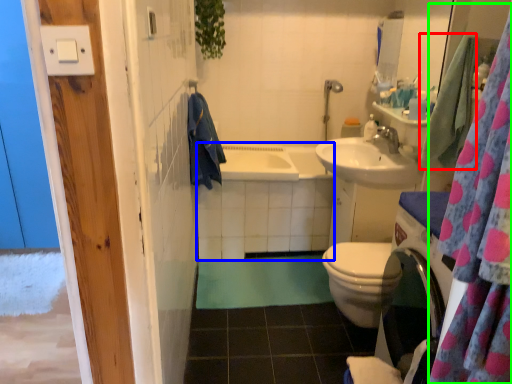
Question: Considering the real-world distances, which object is farthest from bath towel (highlighted by a red box)? bath (highlighted by a blue box) or shower curtain (highlighted by a green box)?

Choices:
 (A) bath
 (B) shower curtain

Answer: (B)